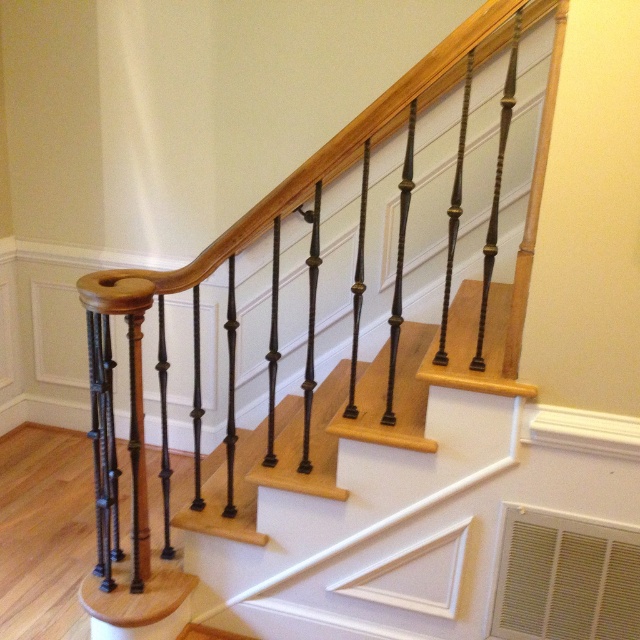
Question: Is black wrought iron railing at upper center further to camera compared to polished wood stair at center?

Choices:
 (A) yes
 (B) no

Answer: (B)

Question: Is black wrought iron railing at upper center bigger than polished wood stair at center?

Choices:
 (A) no
 (B) yes

Answer: (B)

Question: Does black wrought iron railing at upper center have a lesser width compared to polished wood stair at center?

Choices:
 (A) no
 (B) yes

Answer: (A)